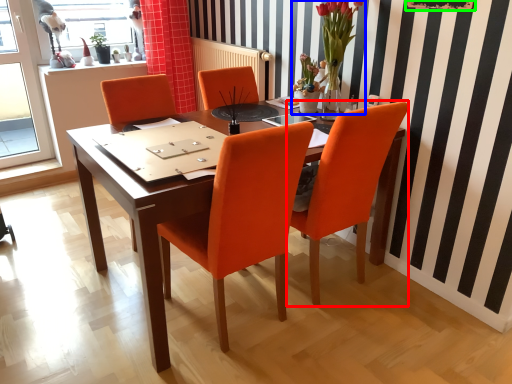
Question: Which object is positioned farthest from chair (highlighted by a red box)? Select from floral arrangement (highlighted by a blue box) and bulletin board (highlighted by a green box).

Choices:
 (A) floral arrangement
 (B) bulletin board

Answer: (B)